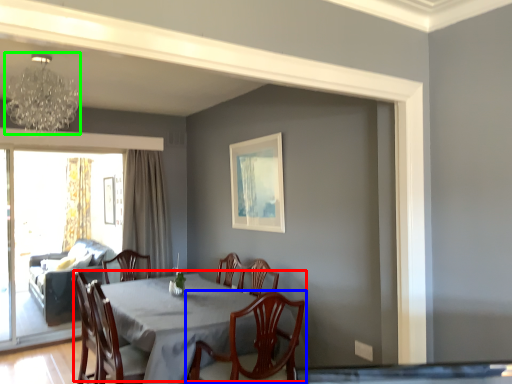
Question: Which object is positioned farthest from kitchen & dining room table (highlighted by a red box)? Select from chair (highlighted by a blue box) and lamp (highlighted by a green box).

Choices:
 (A) chair
 (B) lamp

Answer: (B)